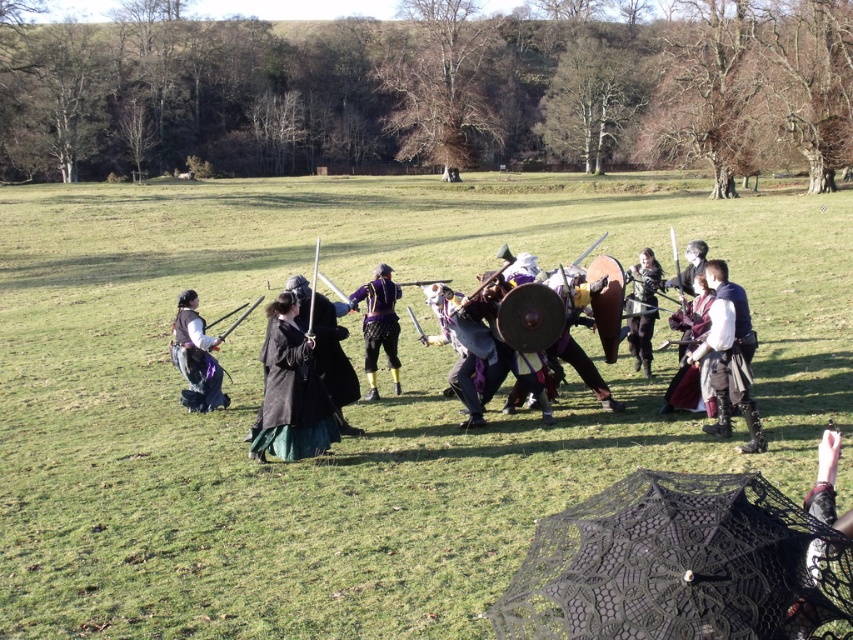
Who is positioned more to the right, shiny purple armor at center or shiny silver armor at center?

shiny silver armor at center

Can you confirm if shiny purple armor at center is positioned to the left of shiny silver armor at center?

Indeed, shiny purple armor at center is positioned on the left side of shiny silver armor at center.

Is point (387, 268) positioned after point (651, 332)?

No, it is in front of (651, 332).

In order to click on shiny purple armor at center in this screenshot , I will do `click(379, 324)`.

Does point (769, 296) lie behind point (399, 390)?

That is True.

The width and height of the screenshot is (853, 640). I want to click on matte black umbrella at center, so pos(352,404).

Which is in front, point (271, 369) or point (537, 305)?

Positioned in front is point (271, 369).

Does point (265, 340) come closer to viewer compared to point (576, 352)?

That is True.

Is point (283, 458) positioned behind point (608, 355)?

That is False.

The image size is (853, 640). Identify the location of dark gray woolen cloak at center. (291, 392).